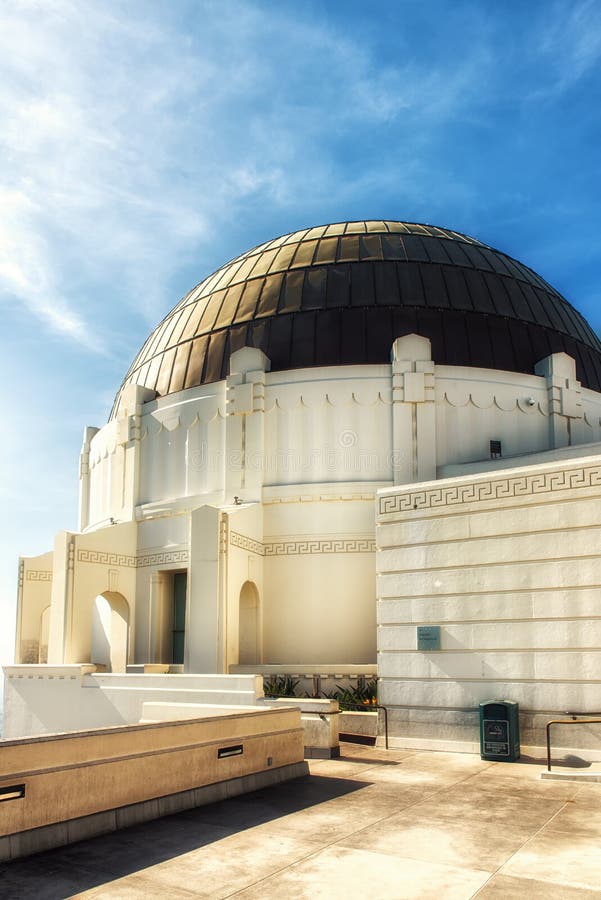
This screenshot has height=900, width=601. Identify the location of plaque. (434, 637).